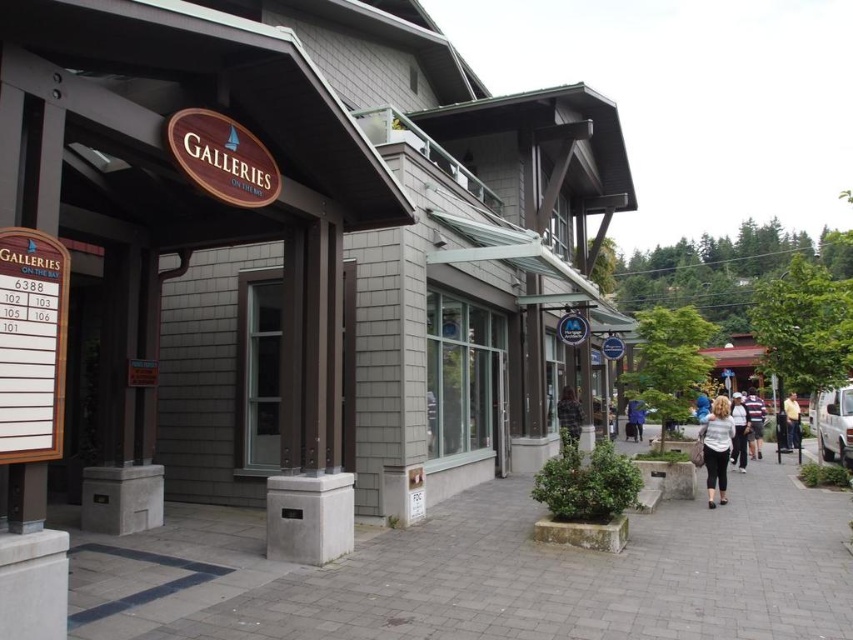
Who is positioned more to the right, matte gray building at center or gray concrete pavement at center?

gray concrete pavement at center is more to the right.

Between point (86, 513) and point (521, 516), which one is positioned behind?

The point (521, 516) is more distant.

Does point (395, 362) come farther from viewer compared to point (318, 602)?

Yes.

At what (x,y) coordinates should I click in order to perform the action: click on matte gray building at center. Please return your answer as a coordinate pair (x, y). This screenshot has width=853, height=640. Looking at the image, I should click on (303, 248).

Who is lower down, white matte shirt at center or light brown leather jacket at center?

light brown leather jacket at center is below.

Is white matte shirt at center shorter than light brown leather jacket at center?

Yes.

What do you see at coordinates (717, 448) in the screenshot? The height and width of the screenshot is (640, 853). I see `white matte shirt at center` at bounding box center [717, 448].

Locate an element on the screen. white matte shirt at center is located at coordinates (717, 448).

Between point (572, 390) and point (701, 397), which one is positioned behind?

Point (701, 397)

What do you see at coordinates (569, 413) in the screenshot?
I see `camouflage jacket at center` at bounding box center [569, 413].

Between point (561, 392) and point (697, 396), which one is positioned behind?

Positioned behind is point (561, 392).

Locate an element on the screen. The image size is (853, 640). camouflage jacket at center is located at coordinates (569, 413).